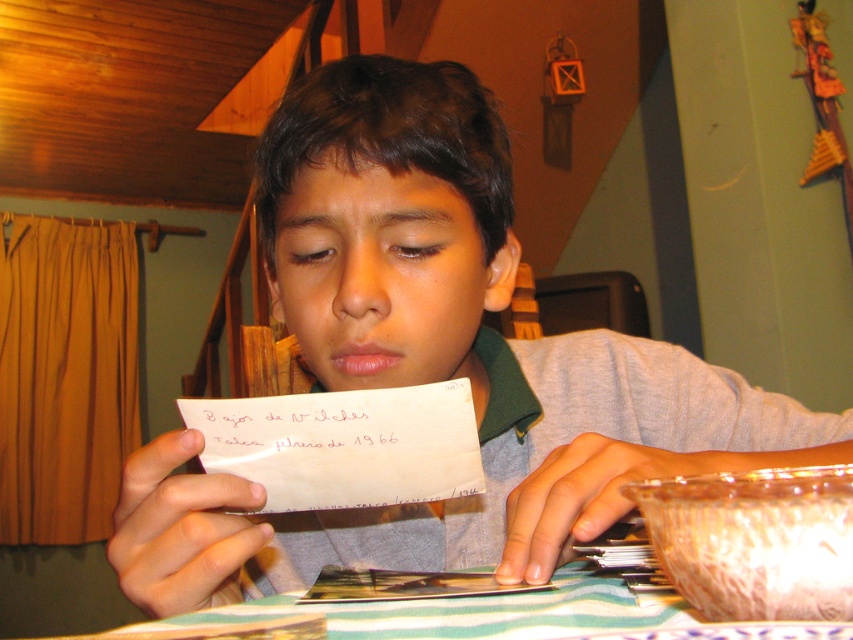
Based on the photo, in the image, there are two pieces of paper at the center of the scene. The white paper at center and the black paper at center. Which one is positioned to the left?

The white paper at center is to the left of the black paper at center.

You are a teacher observing a student who has two papers on their desk. The white paper at center and the black paper at center. Which paper is taller?

The white paper at center is taller than the black paper at center according to the description.